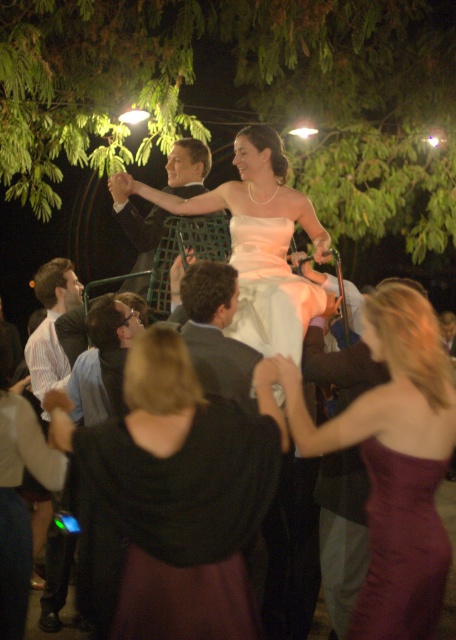
Looking at this image, you are a photographer at the wedding reception. You need to capture a closeup shot of the couple. Given that the black satin dress at center is wider than the shiny black suit at center, which one should you focus on to ensure the entire subject fits in the frame without cropping?

You should focus on the black satin dress at center because it is wider than the shiny black suit at center, so adjusting the frame to accommodate its width will naturally include the suit as well.

You are a photographer at the wedding reception. You need to capture a photo of the black satin dress at center and the shiny black suit at center. Which one is on the right side when facing the couple?

The black satin dress at center is positioned on the right side of the shiny black suit at center, so when facing the couple, the black satin dress at center is on the right side.